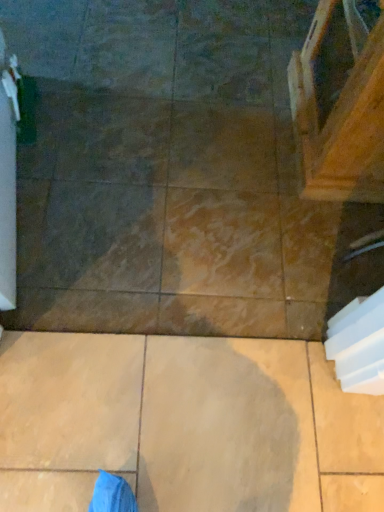
The height and width of the screenshot is (512, 384). What do you see at coordinates (340, 102) in the screenshot? I see `wooden cabinet at upper right` at bounding box center [340, 102].

This screenshot has height=512, width=384. I want to click on wooden cabinet at upper right, so click(340, 102).

Where is `wooden cabinet at upper right`? Image resolution: width=384 pixels, height=512 pixels. wooden cabinet at upper right is located at coordinates (340, 102).